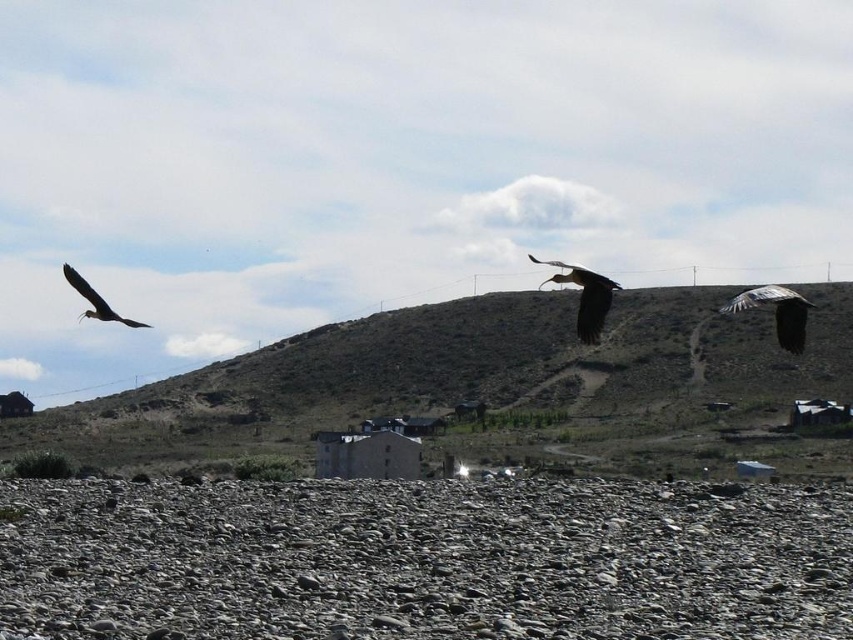
You are standing at the center of the rocky terrain in the foreground of the image. You see a point marked at coordinates (776, 312). What object is located at that point?

The point at coordinates (776, 312) corresponds to the dark brown feathered eagle at upper right.

You are standing in the middle of the rocky terrain and looking towards the sky. Which bird, the dark brown feathered eagle at upper right or the shiny black bird at left, is flying higher?

The dark brown feathered eagle at upper right is flying higher than the shiny black bird at left.

You are a birdwatcher observing the scene. You notice two birds in the sky. The dark brown feathered eagle at upper right and the shiny black bird at left. Which bird has a narrower body shape?

The dark brown feathered eagle at upper right has a narrower body shape than the shiny black bird at left.